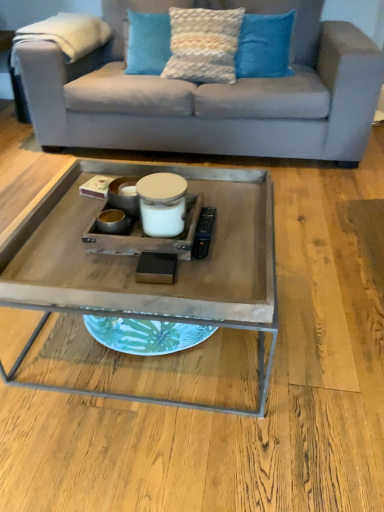
Question: Is textured cream pillow at upper center, which is the second pillow from right to left, thinner than textured blue pillow at upper center, acting as the first pillow starting from the left?

Choices:
 (A) yes
 (B) no

Answer: (B)

Question: Is textured cream pillow at upper center, acting as the second pillow starting from the left, to the left of textured blue pillow at upper center, the third pillow from the right, from the viewer's perspective?

Choices:
 (A) no
 (B) yes

Answer: (A)

Question: From a real-world perspective, is textured cream pillow at upper center, acting as the second pillow starting from the left, beneath textured blue pillow at upper center, acting as the first pillow starting from the left?

Choices:
 (A) yes
 (B) no

Answer: (B)

Question: Is textured cream pillow at upper center, acting as the second pillow starting from the left, at the right side of textured blue pillow at upper center, the third pillow from the right?

Choices:
 (A) yes
 (B) no

Answer: (A)

Question: Can you confirm if textured cream pillow at upper center, acting as the second pillow starting from the left, is bigger than textured blue pillow at upper center, the third pillow from the right?

Choices:
 (A) no
 (B) yes

Answer: (B)

Question: From a real-world perspective, is textured blue pillow at upper center, acting as the first pillow starting from the left, physically located above or below wooden tray at center?

Choices:
 (A) below
 (B) above

Answer: (B)

Question: In the image, is textured blue pillow at upper center, acting as the first pillow starting from the left, positioned in front of or behind wooden tray at center?

Choices:
 (A) front
 (B) behind

Answer: (B)

Question: Is point (145, 34) positioned closer to the camera than point (24, 270)?

Choices:
 (A) farther
 (B) closer

Answer: (A)

Question: Considering the positions of textured blue pillow at upper center, acting as the first pillow starting from the left, and wooden tray at center in the image, is textured blue pillow at upper center, acting as the first pillow starting from the left, bigger or smaller than wooden tray at center?

Choices:
 (A) small
 (B) big

Answer: (A)

Question: Is textured cream pillow at upper center, acting as the second pillow starting from the left, inside or outside of textured blue pillow at upper center, the third pillow from the right?

Choices:
 (A) inside
 (B) outside

Answer: (B)

Question: Looking at their shapes, would you say textured cream pillow at upper center, which is the second pillow from right to left, is wider or thinner than textured blue pillow at upper center, the third pillow from the right?

Choices:
 (A) wide
 (B) thin

Answer: (A)

Question: In the image, is textured cream pillow at upper center, which is the second pillow from right to left, on the left side or the right side of textured blue pillow at upper center, the third pillow from the right?

Choices:
 (A) left
 (B) right

Answer: (B)

Question: From a real-world perspective, is textured cream pillow at upper center, which is the second pillow from right to left, above or below textured blue pillow at upper center, the third pillow from the right?

Choices:
 (A) above
 (B) below

Answer: (A)

Question: From a real-world perspective, relative to wooden tray at center, is blue textured pillow at upper center, which ranks as the third pillow in left-to-right order, vertically above or below?

Choices:
 (A) above
 (B) below

Answer: (A)

Question: Considering the positions of point (288, 69) and point (193, 281), is point (288, 69) closer or farther from the camera than point (193, 281)?

Choices:
 (A) closer
 (B) farther

Answer: (B)